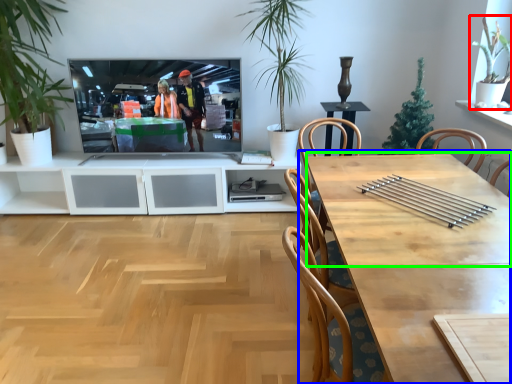
Question: Which object is positioned farthest from houseplant (highlighted by a red box)? Select from table (highlighted by a blue box) and counter top (highlighted by a green box).

Choices:
 (A) table
 (B) counter top

Answer: (A)